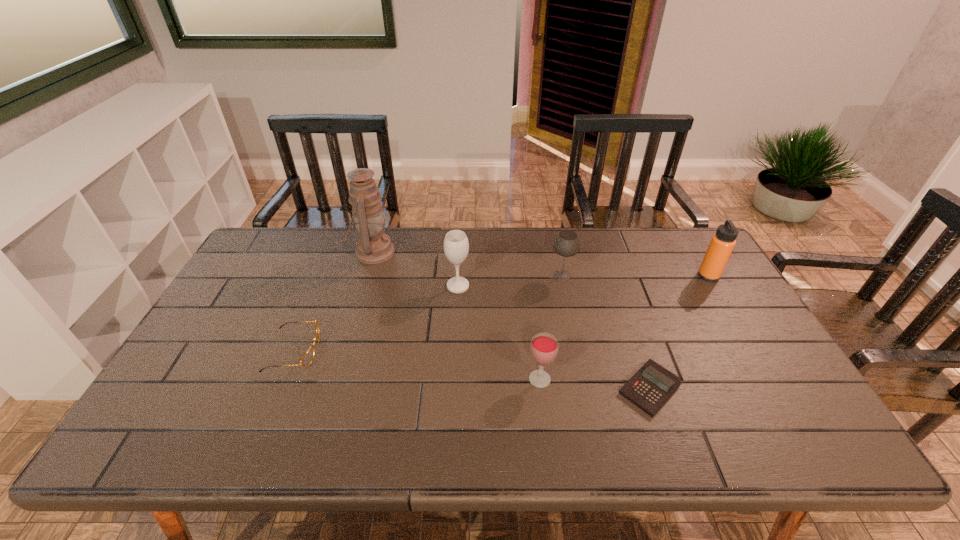
Find the location of a particular element. The height and width of the screenshot is (540, 960). vacant area between the shortest object and the second shortest object is located at coordinates (471, 369).

Identify the location of free space that is in between the thermos bottle and the second shortest object. This screenshot has height=540, width=960. (501, 313).

This screenshot has width=960, height=540. What are the coordinates of `free space between the third object from right to left and the rightmost object` in the screenshot? It's located at (636, 275).

Where is `vacant area that lies between the tallest object and the calculator`? Image resolution: width=960 pixels, height=540 pixels. vacant area that lies between the tallest object and the calculator is located at coordinates (511, 320).

This screenshot has height=540, width=960. Find the location of `free point between the thermos bottle and the spectacles`. free point between the thermos bottle and the spectacles is located at coordinates (501, 313).

Find the location of a particular element. The image size is (960, 540). empty location between the sixth object from left to right and the fourth object from right to left is located at coordinates (594, 384).

What are the coordinates of `vacant space that's between the shortest object and the oil lamp` in the screenshot? It's located at (511, 320).

Locate an element on the screen. free space between the calculator and the fifth object from left to right is located at coordinates (605, 332).

Choose which object is the third nearest neighbor to the second object from right to left. Please provide its 2D coordinates. Your answer should be formatted as a tuple, i.e. [(x, y)], where the tuple contains the x and y coordinates of a point satisfying the conditions above.

[(722, 243)]

Image resolution: width=960 pixels, height=540 pixels. I want to click on the fifth closest object to the tallest wineglass, so click(x=652, y=385).